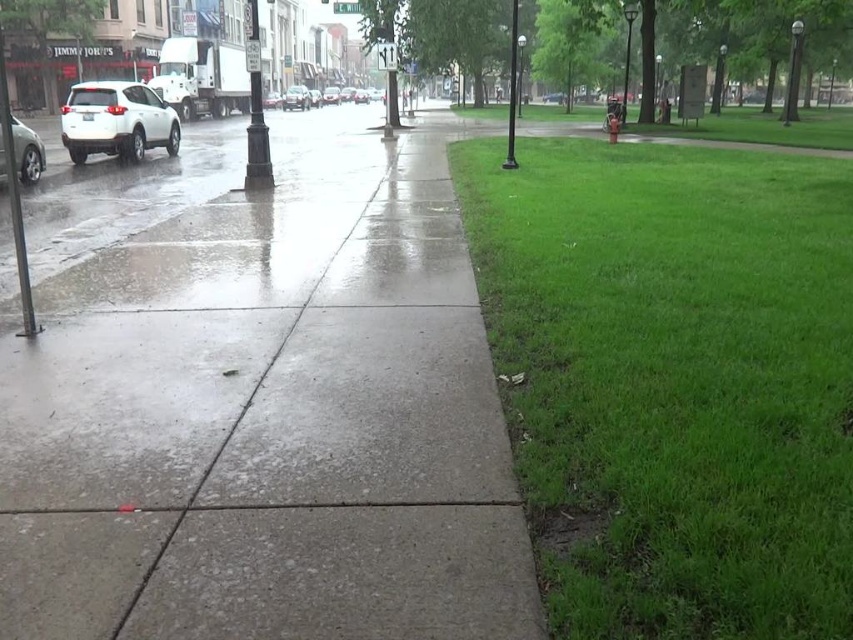
Which of these two, white matte suv at left or silver metallic sedan at left, stands shorter?

silver metallic sedan at left is shorter.

Which is in front, point (96, 131) or point (36, 172)?

Point (36, 172) is more forward.

At what (x,y) coordinates should I click in order to perform the action: click on white matte suv at left. Please return your answer as a coordinate pair (x, y). Looking at the image, I should click on (115, 120).

Is white matte suv at left above shiny silver sedan at center?

No, white matte suv at left is not above shiny silver sedan at center.

Does white matte suv at left appear under shiny silver sedan at center?

Yes, white matte suv at left is below shiny silver sedan at center.

Where is `white matte suv at left`? The width and height of the screenshot is (853, 640). white matte suv at left is located at coordinates (115, 120).

Locate an element on the screen. white matte suv at left is located at coordinates (115, 120).

Between green grass at right and shiny silver sedan at center, which one has more height?

shiny silver sedan at center is taller.

Is point (791, 378) positioned before point (355, 96)?

That is True.

Locate an element on the screen. This screenshot has width=853, height=640. green grass at right is located at coordinates (672, 380).